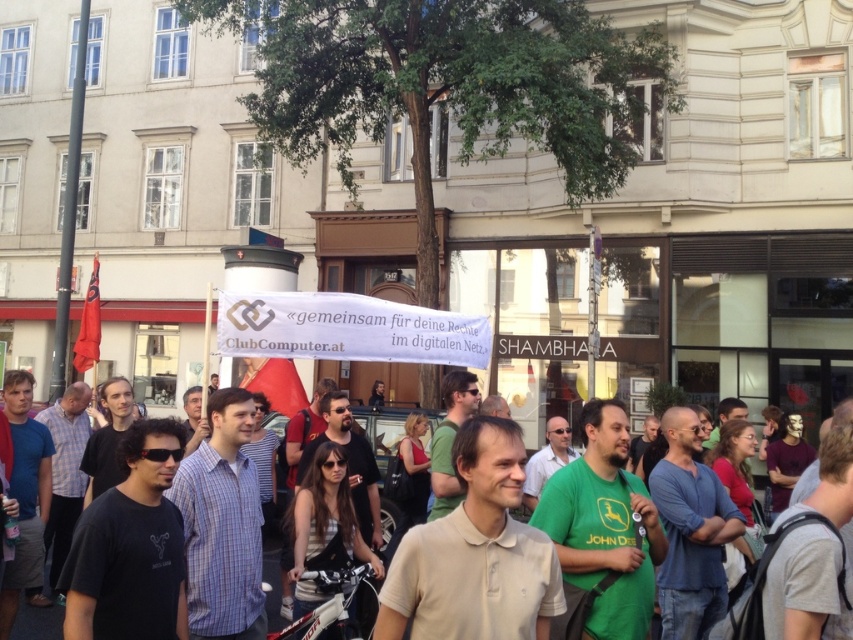
You are a photographer standing in the street scene. You want to take a photo of the light beige polo shirt at center without the white fabric banner at center blocking it. Is this possible given their positions?

The white fabric banner at center is located above the light beige polo shirt at center, so it would block the view. To capture the light beige polo shirt at center without obstruction, you would need to adjust your angle or position to avoid the banner.

You are a photographer trying to capture the light beige polo shirt at center and the white fabric banner at center in the same frame. Since the banner is thinner than the polo shirt, how should you adjust your camera angle to ensure both are fully visible?

Since the white fabric banner at center is thinner than the light beige polo shirt at center, you should position your camera so that the banner is closer to the edge of the frame to accommodate its narrower width while ensuring the wider polo shirt fits comfortably within the shot.

You are standing at the center of the street and want to hang a new banner exactly where the white fabric banner at center is currently located. What are the coordinates where you should place it?

The coordinates for the white fabric banner at center are at point (x=347, y=330).